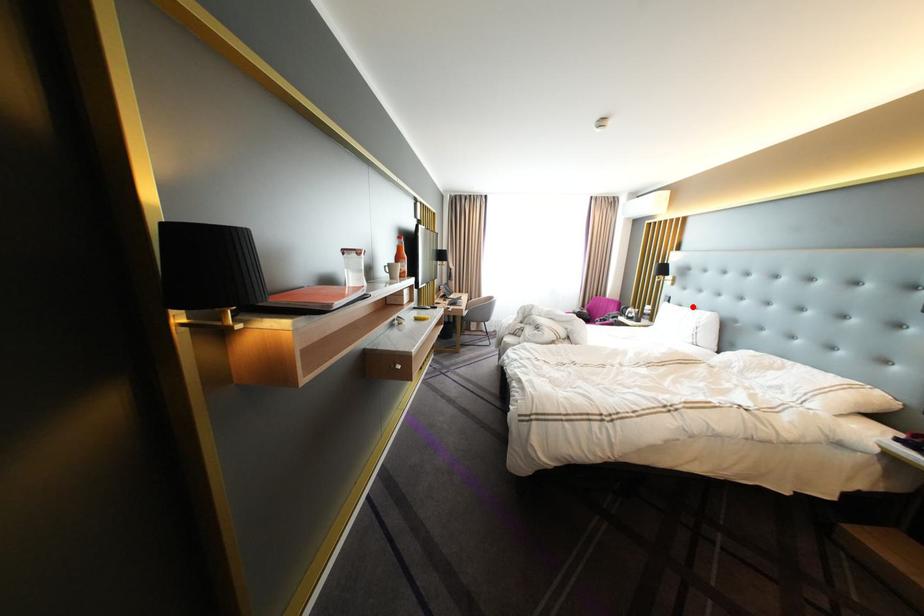
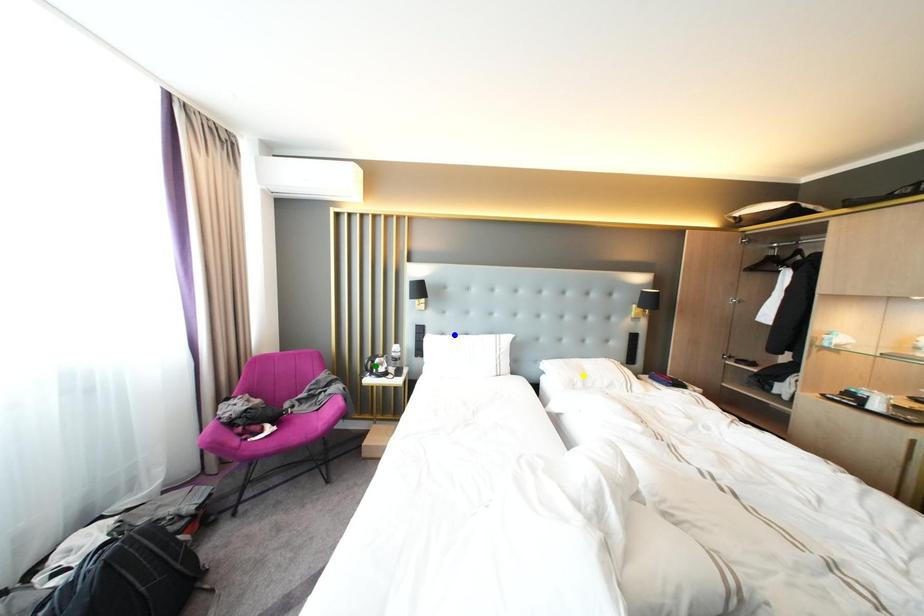
Question: I am providing you with two images of the same scene from different viewpoints. A red point is marked on the first image. You are given multiple points on the second image. Which spot in image 2 lines up with the point in image 1?

Choices:
 (A) blue point
 (B) yellow point
 (C) green point

Answer: (A)